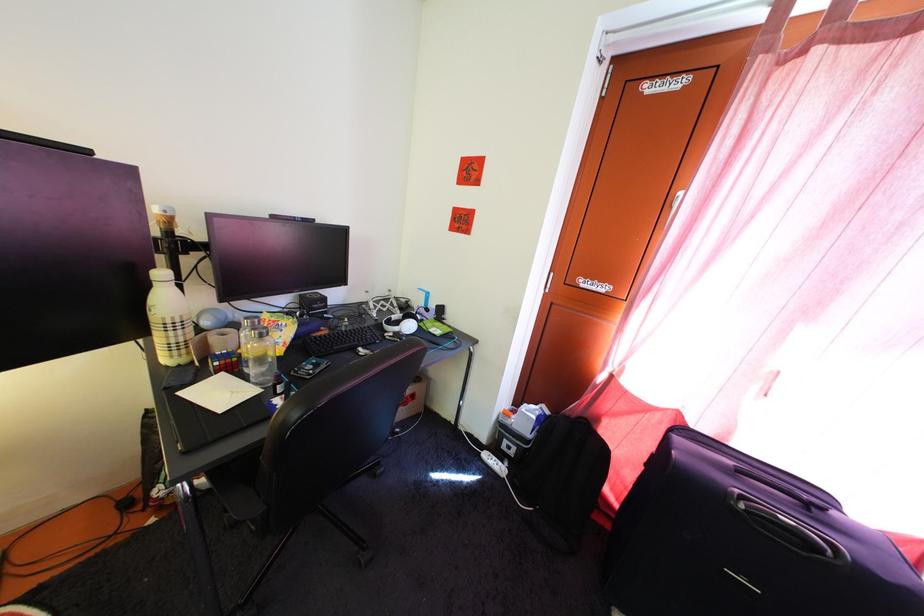
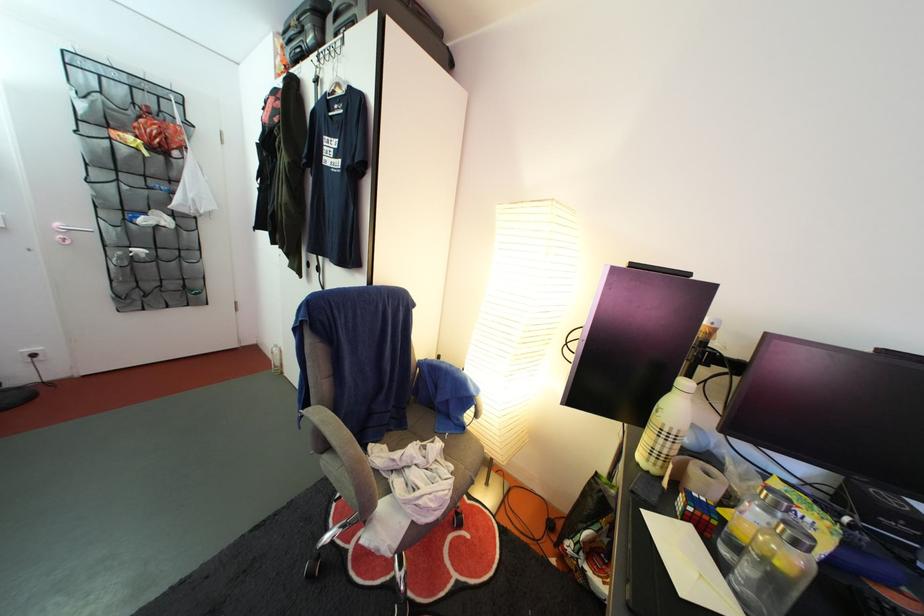
Question: The images are taken continuously from a first-person perspective. In which direction is your viewpoint rotating?

Choices:
 (A) Left
 (B) Right
 (C) Up
 (D) Down

Answer: (A)